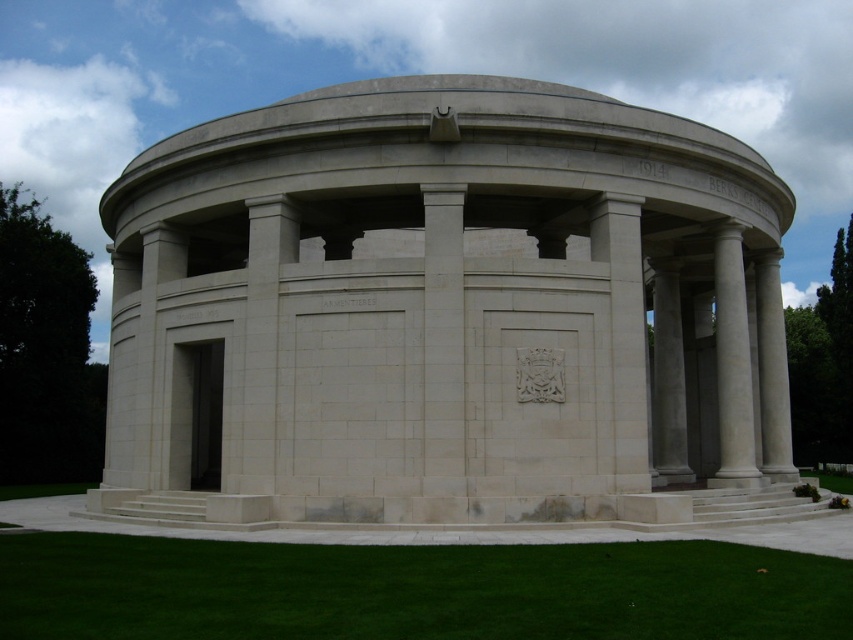
Question: Is white marble column at right smaller than green grass at lower right?

Choices:
 (A) no
 (B) yes

Answer: (B)

Question: Can you confirm if green grass at lower center is wider than green grass at lower right?

Choices:
 (A) yes
 (B) no

Answer: (A)

Question: Which of the following is the farthest from the observer?

Choices:
 (A) (834, 490)
 (B) (747, 352)

Answer: (A)

Question: Which point is closer to the camera taking this photo?

Choices:
 (A) (x=370, y=349)
 (B) (x=74, y=612)
 (C) (x=752, y=436)

Answer: (B)

Question: Is the position of white stone gazebo at center more distant than that of green grass at lower center?

Choices:
 (A) no
 (B) yes

Answer: (B)

Question: Considering the real-world distances, which object is farthest from the white marble column at right?

Choices:
 (A) green grass at lower right
 (B) green grass at lower center
 (C) white stone gazebo at center

Answer: (A)